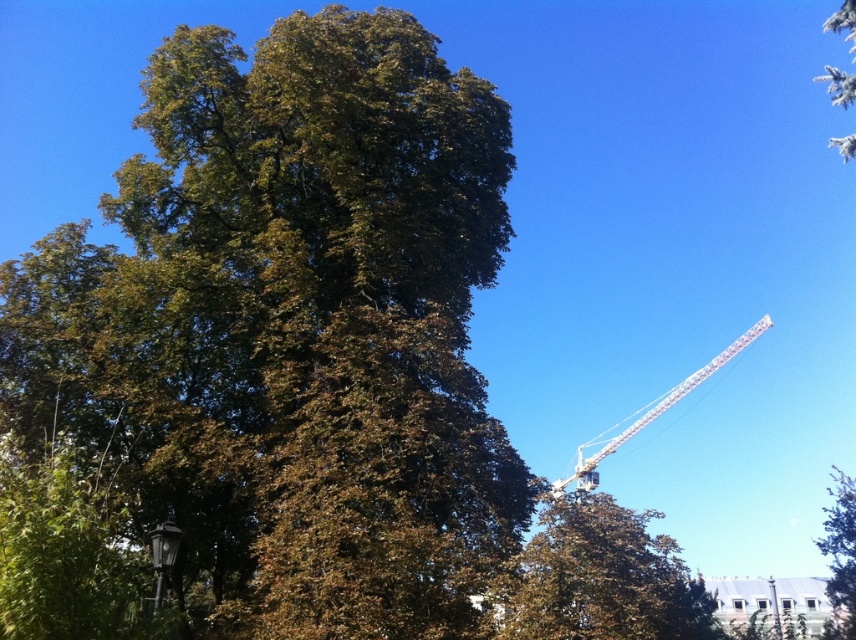
Question: Observing the image, what is the correct spatial positioning of green leafy tree at upper center in reference to white metallic crane at upper right?

Choices:
 (A) below
 (B) above

Answer: (A)

Question: Which point is closer to the camera taking this photo?

Choices:
 (A) (385, 328)
 (B) (767, 324)

Answer: (A)

Question: Is white metallic crane at upper right to the right of white fluffy snow at upper right from the viewer's perspective?

Choices:
 (A) yes
 (B) no

Answer: (B)

Question: Which object appears farthest from the camera in this image?

Choices:
 (A) green leafy tree at upper right
 (B) green leafy tree at center
 (C) white metallic crane at upper right
 (D) white fluffy snow at upper right

Answer: (A)

Question: Is green leafy tree at upper right further to the viewer compared to white metallic crane at upper right?

Choices:
 (A) yes
 (B) no

Answer: (A)

Question: Which is nearer to the green leafy tree at upper right?

Choices:
 (A) white metallic crane at upper right
 (B) white fluffy snow at upper right
 (C) green leafy tree at upper center
 (D) green leafy tree at center

Answer: (A)